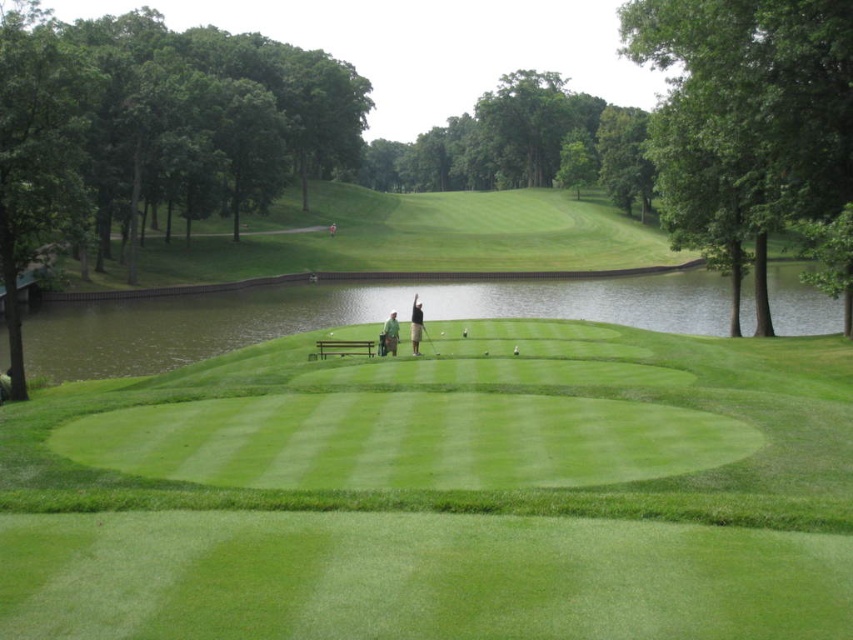
Question: Can you confirm if green fabric shirt at center is positioned to the left of dark gray pants at center?

Choices:
 (A) yes
 (B) no

Answer: (A)

Question: Among these points, which one is farthest from the camera?

Choices:
 (A) (422, 333)
 (B) (393, 320)
 (C) (436, 592)

Answer: (A)

Question: Which of the following is the farthest from the observer?

Choices:
 (A) (345, 456)
 (B) (361, 320)
 (C) (413, 348)

Answer: (B)

Question: Can you confirm if green water at center is smaller than green fabric shirt at center?

Choices:
 (A) yes
 (B) no

Answer: (B)

Question: Estimate the real-world distances between objects in this image. Which object is farther from the green fabric shirt at center?

Choices:
 (A) green water at center
 (B) metallic silver golf club at center

Answer: (A)

Question: Does green water at center lie in front of metallic silver golf club at center?

Choices:
 (A) yes
 (B) no

Answer: (B)